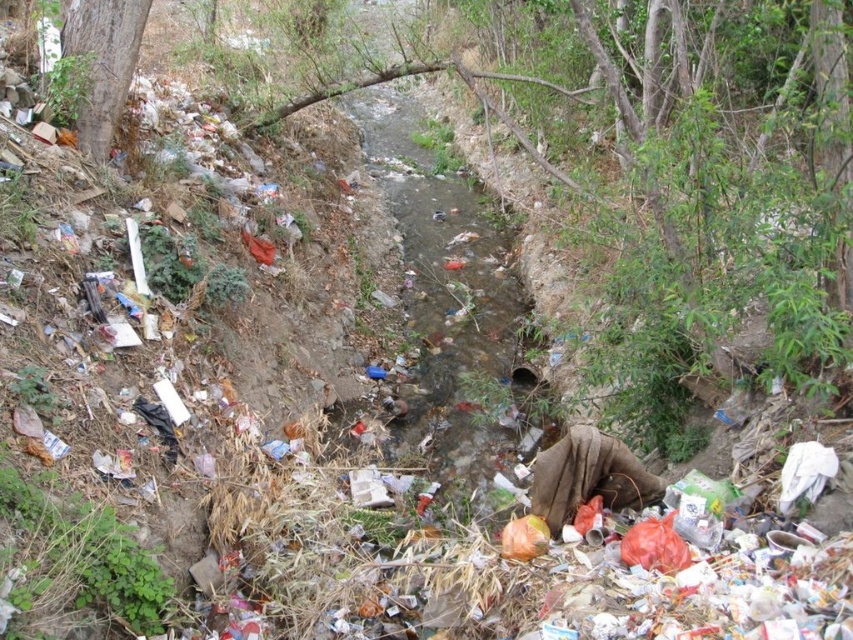
Question: Can you confirm if brown rough tree at center is bigger than smooth brown tree trunk at upper left?

Choices:
 (A) yes
 (B) no

Answer: (A)

Question: Which point appears closest to the camera in this image?

Choices:
 (A) (679, 150)
 (B) (97, 33)

Answer: (A)

Question: Which of the following is the closest to the observer?

Choices:
 (A) (97, 112)
 (B) (844, 307)

Answer: (B)

Question: Observing the image, what is the correct spatial positioning of brown rough tree at center in reference to smooth brown tree trunk at upper left?

Choices:
 (A) below
 (B) above

Answer: (B)

Question: Is brown rough tree at center further to camera compared to smooth brown tree trunk at upper left?

Choices:
 (A) no
 (B) yes

Answer: (A)